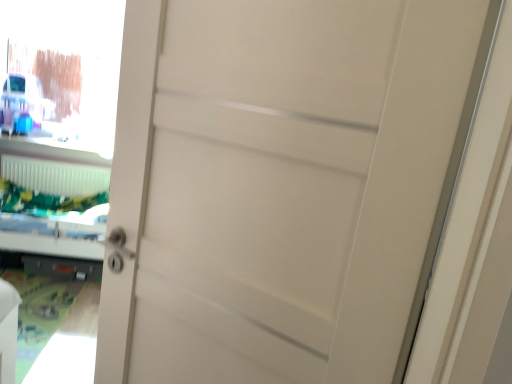
Question: Considering the positions of green fabric bed at left and white plastic radiator at lower left in the image, is green fabric bed at left bigger or smaller than white plastic radiator at lower left?

Choices:
 (A) small
 (B) big

Answer: (B)

Question: From the image's perspective, is green fabric bed at left above or below white plastic radiator at lower left?

Choices:
 (A) above
 (B) below

Answer: (B)

Question: Estimate the real-world distances between objects in this image. Which object is closer to the transparent glass window screen at upper left?

Choices:
 (A) green fabric bed at left
 (B) white plastic radiator at lower left

Answer: (B)

Question: Which object is positioned farthest from the transparent glass window screen at upper left?

Choices:
 (A) green fabric bed at left
 (B) white plastic radiator at lower left

Answer: (A)